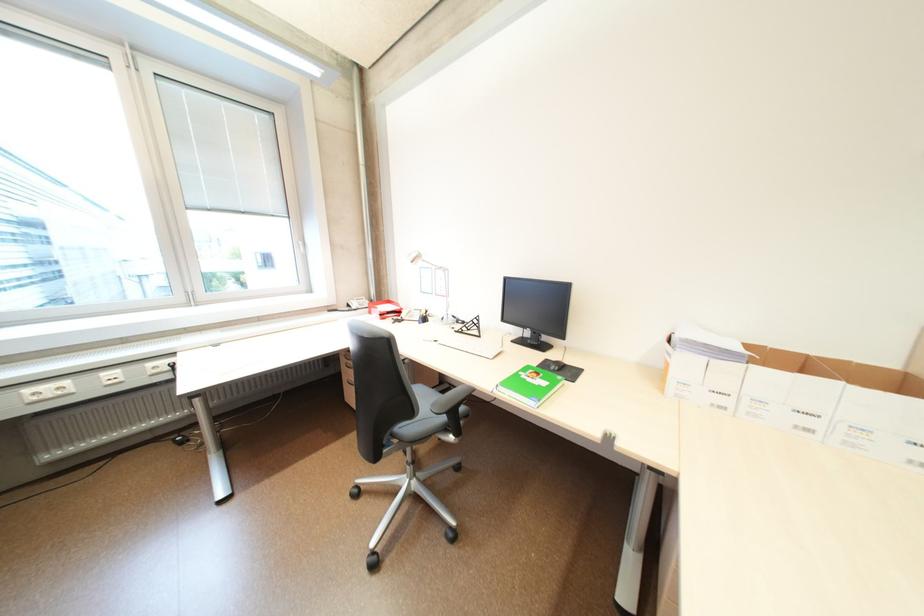
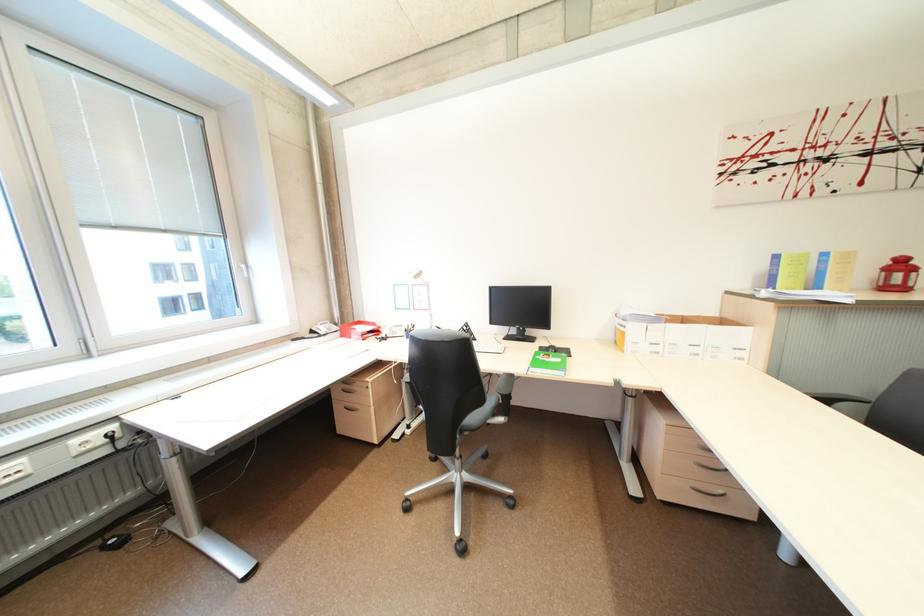
Find the pixel in the second image that matches (x=511, y=389) in the first image.

(541, 370)